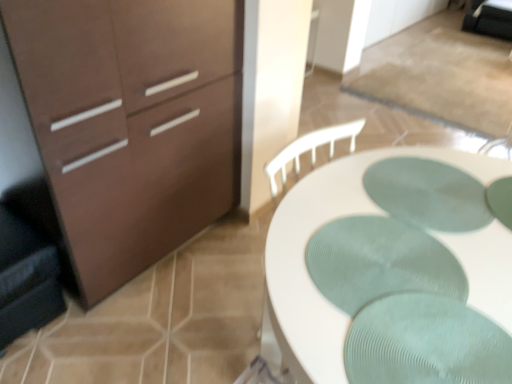
The width and height of the screenshot is (512, 384). What are the coordinates of `free spot below green ribbed placemat at center, which is the 2th oval in back-to-front order (from a real-world perspective)` in the screenshot? It's located at (381, 285).